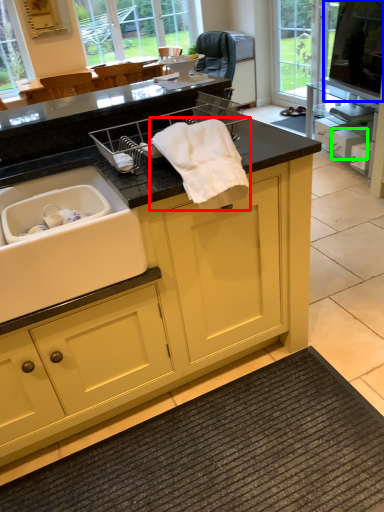
Question: Which is farther away from bath towel (highlighted by a red box)? window screen (highlighted by a blue box) or drawer (highlighted by a green box)?

Choices:
 (A) window screen
 (B) drawer

Answer: (A)